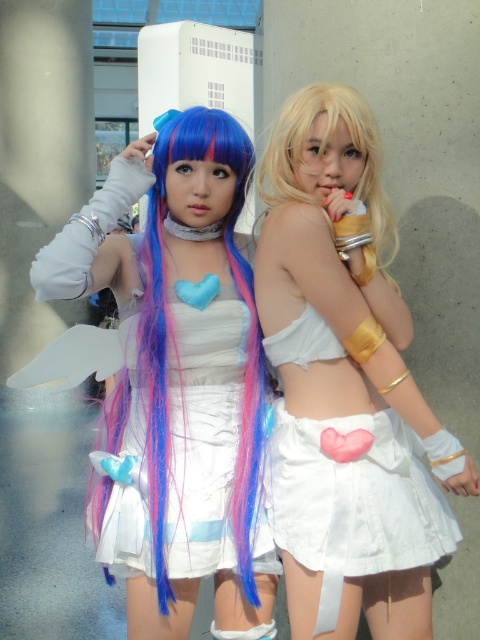
Is matte white dress at center further to camera compared to white matte skirt at center?

Yes, matte white dress at center is further from the viewer.

Does point (146, 576) come closer to viewer compared to point (362, 164)?

Yes, it is.

In order to click on matte white dress at center in this screenshot , I will do `click(172, 380)`.

Does white matte skirt at center appear on the right side of blonde silky hair at upper right?

Correct, you'll find white matte skirt at center to the right of blonde silky hair at upper right.

Measure the distance between white matte skirt at center and blonde silky hair at upper right.

The distance of white matte skirt at center from blonde silky hair at upper right is 9.71 inches.

Is point (374, 557) positioned behind point (268, 150)?

No, it is not.

Locate an element on the screen. This screenshot has width=480, height=640. white matte skirt at center is located at coordinates (346, 387).

Between matte white dress at center and blonde silky hair at upper right, which one is positioned lower?

matte white dress at center is lower down.

Does point (203, 520) lie in front of point (316, 99)?

Yes, point (203, 520) is in front of point (316, 99).

I want to click on matte white dress at center, so (x=172, y=380).